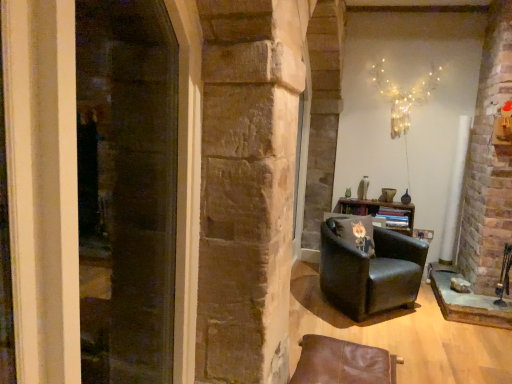
Identify the location of free space above brown leather chair at lower right, which is counted as the 1th chair, starting from the front (from a real-world perspective). (337, 360).